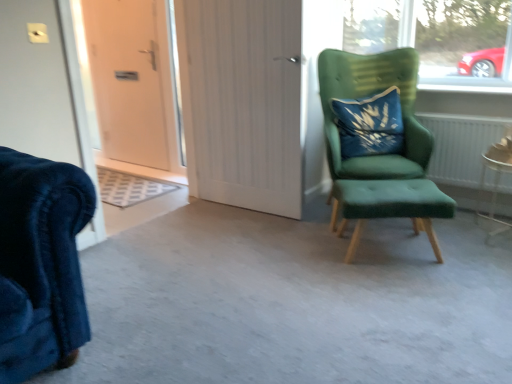
Question: Is white textured radiator at right in front of or behind white wood door at center, which ranks as the first door in right-to-left order, in the image?

Choices:
 (A) front
 (B) behind

Answer: (B)

Question: In terms of width, does white textured radiator at right look wider or thinner when compared to white wood door at center, the second door positioned from the left?

Choices:
 (A) wide
 (B) thin

Answer: (A)

Question: Considering the real-world distances, which object is farthest from the green fabric chair at right?

Choices:
 (A) white matte door at left, the second door from the right
 (B) green fabric stool at right
 (C) white wood door at center, which ranks as the first door in right-to-left order
 (D) blue velvet pillow at upper right
 (E) white textured radiator at right

Answer: (A)

Question: Estimate the real-world distances between objects in this image. Which object is farther from the metallic silver side table at lower right?

Choices:
 (A) white matte door at left, which ranks as the 1th door in left-to-right order
 (B) white wood door at center, marked as the 2th door in a back-to-front arrangement
 (C) white textured radiator at right
 (D) blue velvet pillow at upper right
 (E) green fabric chair at right

Answer: (A)